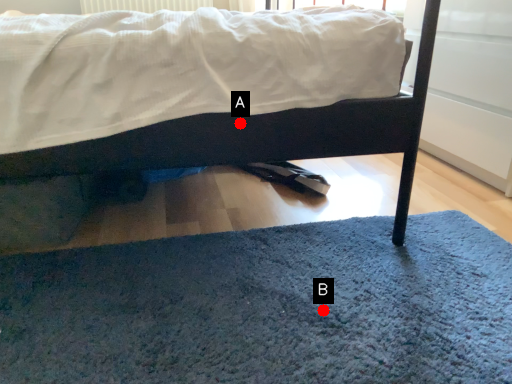
Question: Two points are circled on the image, labeled by A and B beside each circle. Which point is closer to the camera?

Choices:
 (A) A is closer
 (B) B is closer

Answer: (B)